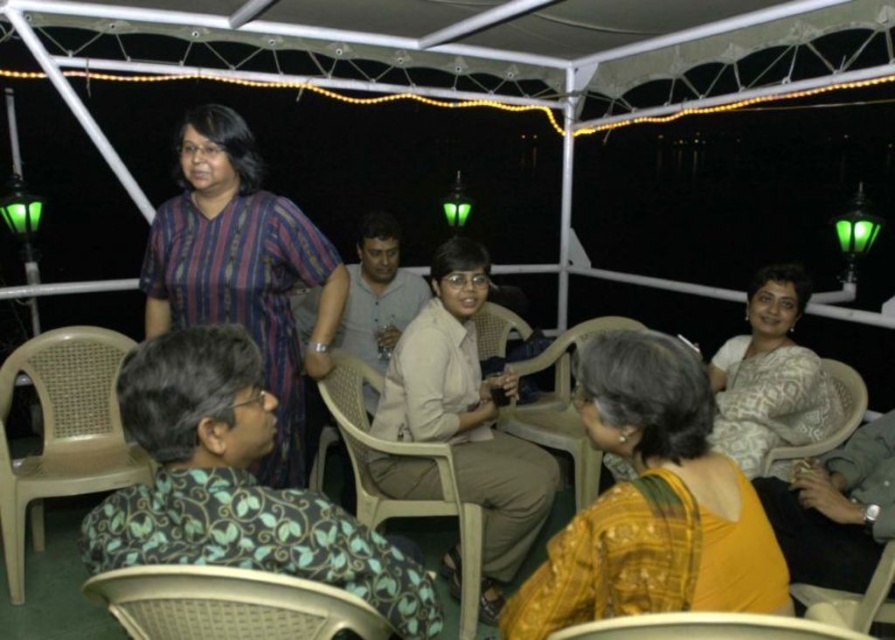
You are a photographer at the event and want to capture a photo of the white patterned saree at center and the matte plastic chair at lower right. Which object is positioned higher in the frame?

The white patterned saree at center is above the matte plastic chair at lower right, so it is positioned higher in the frame.

You are at the center of the scene and want to find the yellow silk saree at lower right. Which direction should you look to locate it?

You should look to your lower right to locate the yellow silk saree at lower right.

You are a photographer trying to capture a clear photo of the yellow silk saree at lower right and the patterned fabric chair at lower right. Which object should you focus on first to ensure it appears sharp in the photo?

You should focus on the yellow silk saree at lower right first because it is much taller than the patterned fabric chair at lower right, making it more prominent in the frame.